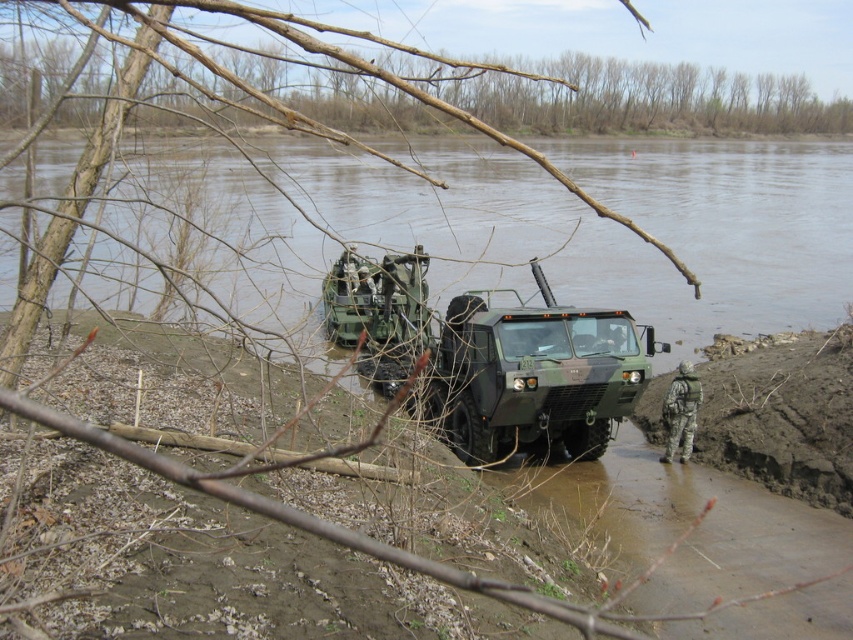
Who is more forward, (412,349) or (555,124)?

Point (412,349) is in front.

Does green matte military truck at center have a greater height compared to brown bark tree at upper center?

No.

At what (x,y) coordinates should I click in order to perform the action: click on green matte military truck at center. Please return your answer as a coordinate pair (x, y). The image size is (853, 640). Looking at the image, I should click on (532, 376).